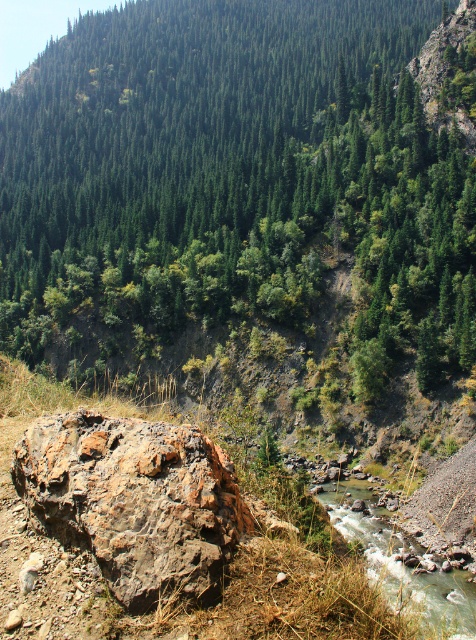
You are a hiker planning to cross the white gravelly water at lower center. You see a green matte tree at upper center nearby. Which object is larger in size?

The green matte tree at upper center is bigger than the white gravelly water at lower center.

Consider the image. You are hiking and come across a rugged landscape with a dense forested mountain slope. You see a rusty rock at center and a white gravelly water at lower center. Which object is positioned to the left when viewed from your perspective?

The rusty rock at center is to the left of white gravelly water at lower center.

You are standing at the base of the mountain and want to take a photo of the green matte tree at upper center. If your camera has a maximum focus range of 50 meters, will you be able to capture a clear image of the tree?

The green matte tree at upper center is 55.36 meters away from the camera. Since the camera can only focus up to 50 meters, it won not be able to capture a clear image of the tree.